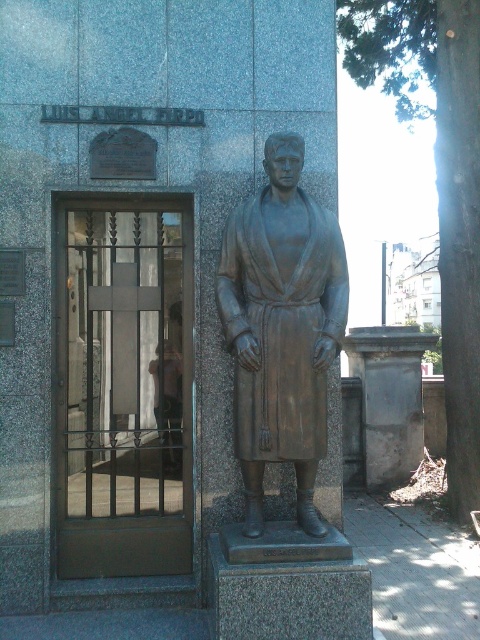
Question: Which of the following is the farthest from the observer?

Choices:
 (A) bronze statue at center
 (B) dark brown metal gate at left

Answer: (B)

Question: Does dark brown metal gate at left have a smaller size compared to bronze statue at center?

Choices:
 (A) yes
 (B) no

Answer: (A)

Question: Is dark brown metal gate at left bigger than bronze statue at center?

Choices:
 (A) yes
 (B) no

Answer: (B)

Question: Does dark brown metal gate at left have a smaller size compared to bronze statue at center?

Choices:
 (A) no
 (B) yes

Answer: (B)